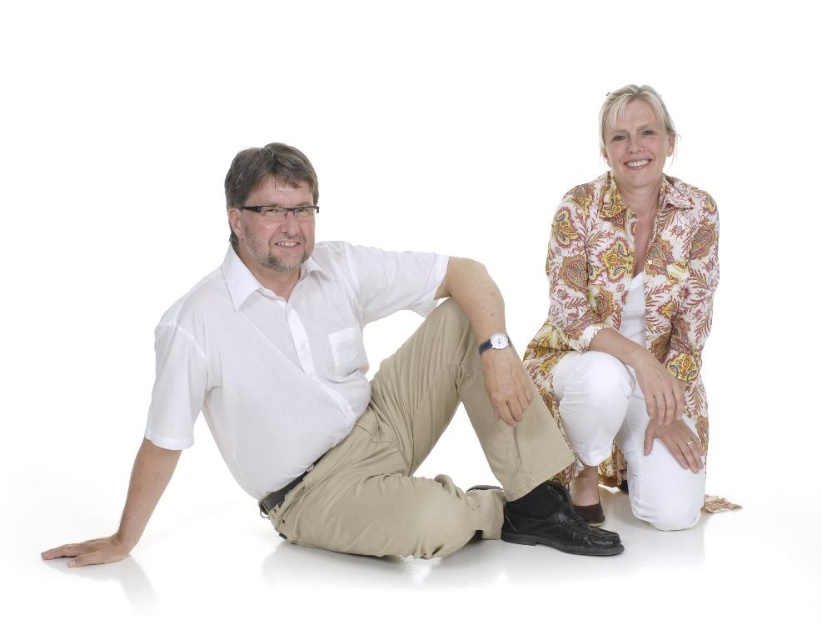
Does white smooth shirt at left appear on the left side of khaki pants at center?

Indeed, white smooth shirt at left is positioned on the left side of khaki pants at center.

Is point (215, 316) closer to camera compared to point (317, 484)?

Yes, point (215, 316) is closer to viewer.

The width and height of the screenshot is (822, 640). I want to click on white smooth shirt at left, so click(278, 356).

Who is taller, white cotton shirt at left or printed fabric blouse at upper right?

With more height is printed fabric blouse at upper right.

Does white cotton shirt at left have a greater height compared to printed fabric blouse at upper right?

No, white cotton shirt at left is not taller than printed fabric blouse at upper right.

This screenshot has height=640, width=822. Find the location of `white cotton shirt at left`. white cotton shirt at left is located at coordinates (344, 390).

Identify the location of white cotton shirt at left. This screenshot has width=822, height=640. tap(344, 390).

Consider the image. Who is more distant from viewer, (359, 403) or (266, 413)?

The point (359, 403) is more distant.

Can you confirm if white cotton shirt at left is thinner than white smooth shirt at left?

In fact, white cotton shirt at left might be wider than white smooth shirt at left.

Image resolution: width=822 pixels, height=640 pixels. I want to click on white cotton shirt at left, so click(344, 390).